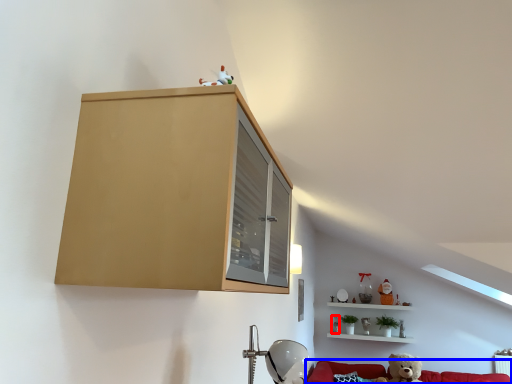
Question: Which of the following is the farthest to the observer, toy (highlighted by a red box) or couch (highlighted by a blue box)?

Choices:
 (A) toy
 (B) couch

Answer: (A)